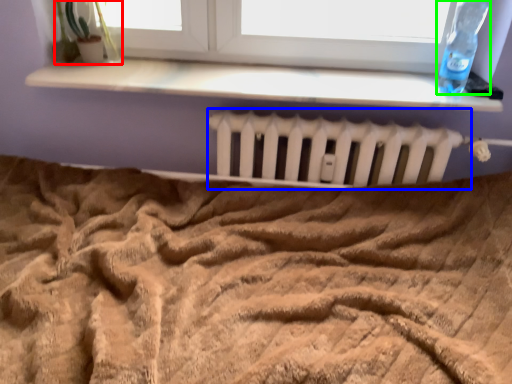
Question: Which is nearer to the plant (highlighted by a red box)? radiator (highlighted by a blue box) or bottle (highlighted by a green box).

Choices:
 (A) radiator
 (B) bottle

Answer: (A)